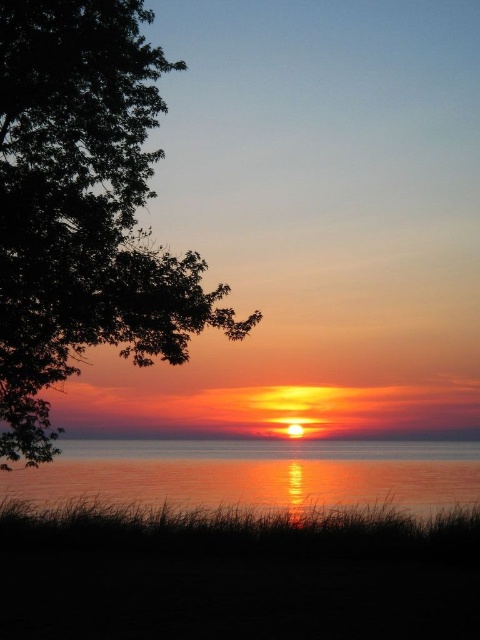
You are standing at the point labeled as point (302, 444) and want to walk towards the point labeled as point (10, 410). Which direction should you move to get closer to your destination?

To move towards point (10, 410) from point (302, 444), you should move diagonally upwards and to the left since point (10, 410) is closer to the viewer and positioned to the left of point (302, 444).

You are standing at the point marked by the coordinates point [83,211] in the sunset scene. What object is directly in front of you?

The point [83,211] indicates the green leafy tree at left, so the object directly in front of you is the green leafy tree at left.